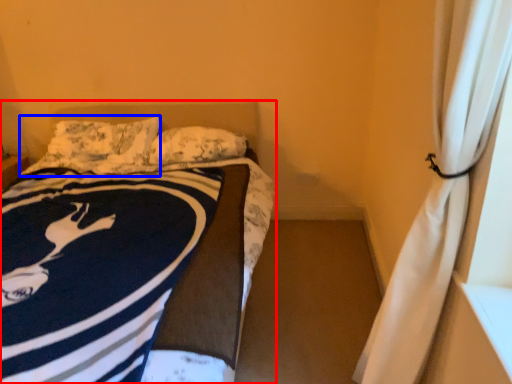
Question: Among these objects, which one is nearest to the camera, bed (highlighted by a red box) or pillow (highlighted by a blue box)?

Choices:
 (A) bed
 (B) pillow

Answer: (A)